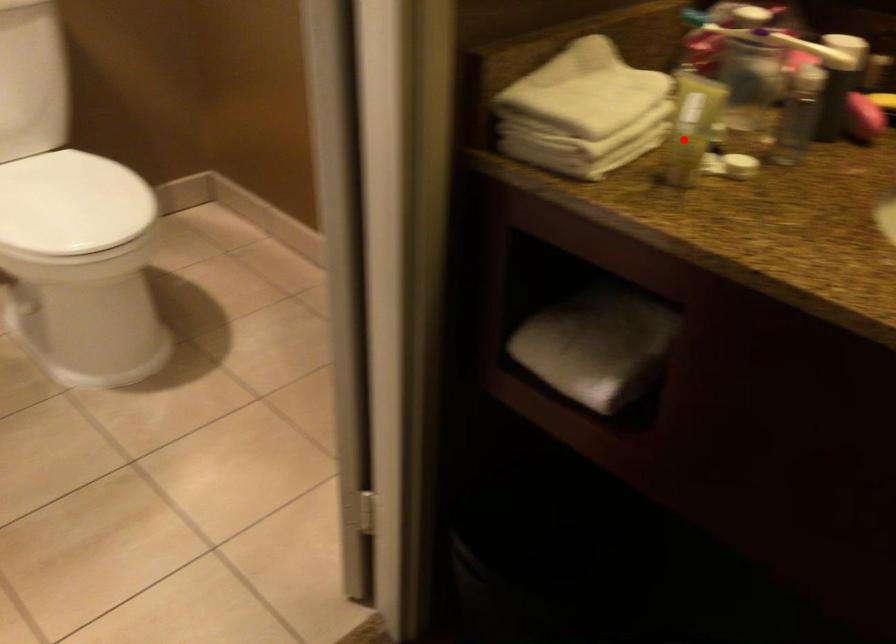
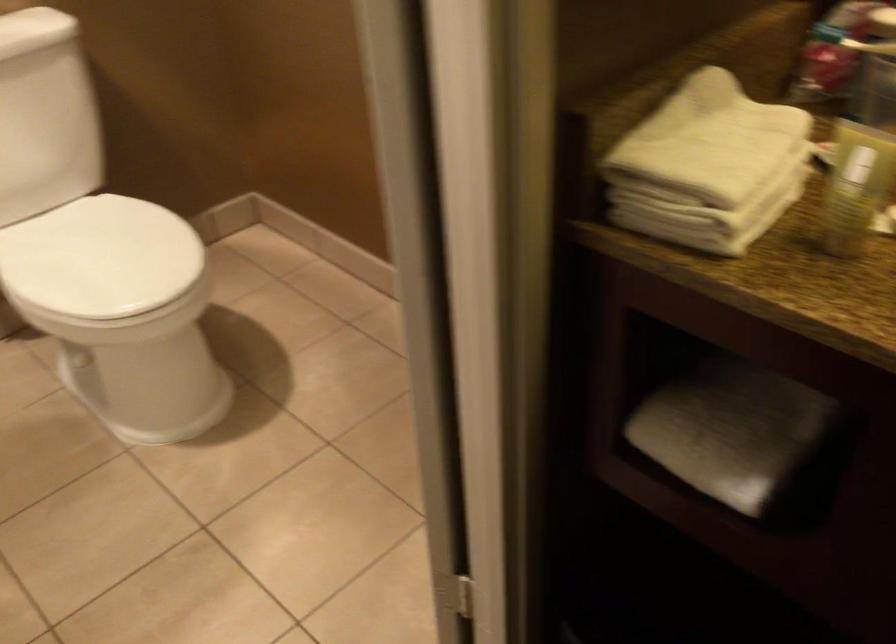
Locate, in the second image, the point that corresponds to the highlighted location in the first image.

(849, 204)